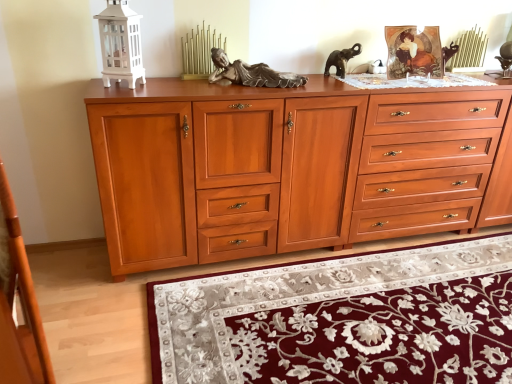
Question: Is wooden drawer at center, which is the 2th drawer from right to left, wider than velvet burgundy rug at lower center?

Choices:
 (A) no
 (B) yes

Answer: (A)

Question: Is there a large distance between wooden drawer at center, which is the 2th drawer from right to left, and velvet burgundy rug at lower center?

Choices:
 (A) yes
 (B) no

Answer: (B)

Question: Does wooden drawer at center, which ranks as the first drawer in left-to-right order, have a lesser height compared to velvet burgundy rug at lower center?

Choices:
 (A) yes
 (B) no

Answer: (B)

Question: From a real-world perspective, is wooden drawer at center, which is the 2th drawer from right to left, located beneath velvet burgundy rug at lower center?

Choices:
 (A) no
 (B) yes

Answer: (A)

Question: Can you confirm if wooden drawer at center, which ranks as the first drawer in left-to-right order, is thinner than velvet burgundy rug at lower center?

Choices:
 (A) yes
 (B) no

Answer: (A)

Question: Is cherry wood drawers at right, acting as the 2th drawer starting from the left, taller or shorter than velvet burgundy rug at lower center?

Choices:
 (A) short
 (B) tall

Answer: (B)

Question: From a real-world perspective, relative to velvet burgundy rug at lower center, is cherry wood drawers at right, acting as the 2th drawer starting from the left, vertically above or below?

Choices:
 (A) below
 (B) above

Answer: (B)

Question: Is point (448, 122) positioned closer to the camera than point (281, 274)?

Choices:
 (A) closer
 (B) farther

Answer: (B)

Question: Would you say cherry wood drawers at right, acting as the 2th drawer starting from the left, is inside or outside velvet burgundy rug at lower center?

Choices:
 (A) outside
 (B) inside

Answer: (A)

Question: Do you think velvet burgundy rug at lower center is within cherry wood chest of drawers at center, or outside of it?

Choices:
 (A) outside
 (B) inside

Answer: (A)

Question: From a real-world perspective, is velvet burgundy rug at lower center positioned above or below cherry wood chest of drawers at center?

Choices:
 (A) below
 (B) above

Answer: (A)

Question: Considering the positions of point (386, 284) and point (297, 132), is point (386, 284) closer or farther from the camera than point (297, 132)?

Choices:
 (A) farther
 (B) closer

Answer: (A)

Question: In the image, is velvet burgundy rug at lower center positioned in front of or behind cherry wood chest of drawers at center?

Choices:
 (A) behind
 (B) front

Answer: (B)

Question: Does point (262, 122) appear closer or farther from the camera than point (189, 147)?

Choices:
 (A) farther
 (B) closer

Answer: (A)

Question: From a real-world perspective, is wooden drawer at center, which ranks as the first drawer in left-to-right order, positioned above or below cherry wood chest of drawers at center?

Choices:
 (A) below
 (B) above

Answer: (B)